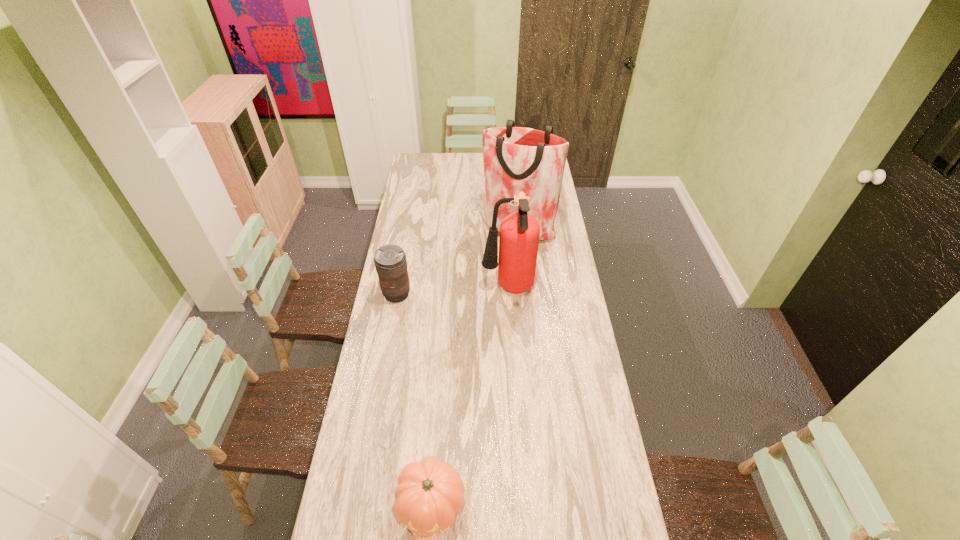
Locate an element on the screen. This screenshot has height=540, width=960. the farthest object is located at coordinates (515, 159).

Image resolution: width=960 pixels, height=540 pixels. I want to click on fire extinguisher, so click(x=519, y=236).

At what (x,y) coordinates should I click in order to perform the action: click on telephoto lens. Please return your answer as a coordinate pair (x, y). Image resolution: width=960 pixels, height=540 pixels. Looking at the image, I should click on (390, 261).

Locate an element on the screen. The height and width of the screenshot is (540, 960). the third tallest object is located at coordinates (390, 261).

This screenshot has height=540, width=960. I want to click on vacant space situated on the back of the grocery bag, so click(515, 198).

Find the location of `vacant region located 0.220m at the nozzle of the fire extinguisher`. vacant region located 0.220m at the nozzle of the fire extinguisher is located at coordinates (431, 289).

The height and width of the screenshot is (540, 960). I want to click on vacant space located at the nozzle of the fire extinguisher, so click(420, 289).

Identify the location of free space located 0.300m at the nozzle of the fire extinguisher. (413, 289).

This screenshot has width=960, height=540. I want to click on vacant space situated 0.390m on the side of the second shortest object where the control switches are located, so click(380, 386).

Identify the location of object that is at the left edge. This screenshot has width=960, height=540. (390, 261).